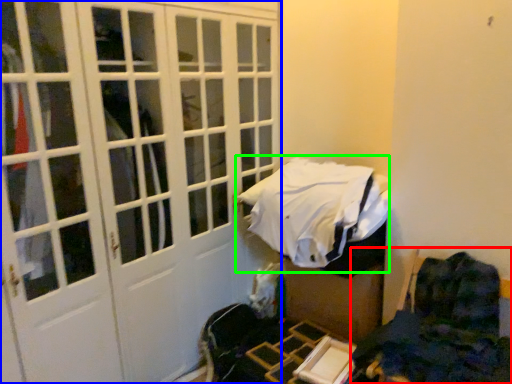
Question: Which object is the closest to the furniture (highlighted by a red box)? Choose among these: door (highlighted by a blue box) or bed (highlighted by a green box).

Choices:
 (A) door
 (B) bed

Answer: (B)